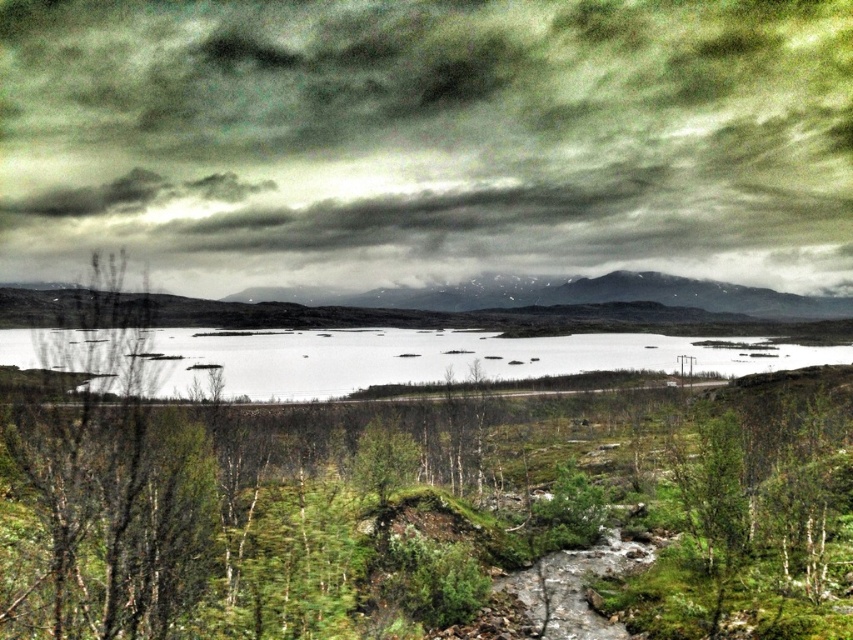
Does cloudy sky at upper center have a greater width compared to green leafy shrubs at center?

Correct, the width of cloudy sky at upper center exceeds that of green leafy shrubs at center.

Can you confirm if cloudy sky at upper center is taller than green leafy shrubs at center?

Yes.

Between point (651, 259) and point (164, 506), which one is positioned behind?

The point (651, 259) is more distant.

Locate an element on the screen. This screenshot has width=853, height=640. cloudy sky at upper center is located at coordinates click(426, 140).

Is cloudy sky at upper center to the right of white smooth water at center from the viewer's perspective?

No, cloudy sky at upper center is not to the right of white smooth water at center.

Which is behind, point (554, 48) or point (347, 346)?

The point (554, 48) is behind.

Is point (669, 244) in front of point (270, 339)?

That is False.

You are a GUI agent. You are given a task and a screenshot of the screen. Output one action in this format:
    pyautogui.click(x=<x>, y=<y>)
    Task: Click on the cloudy sky at upper center
    The width and height of the screenshot is (853, 640).
    Given the screenshot: What is the action you would take?
    pyautogui.click(x=426, y=140)

Is point (770, 424) positioned in front of point (80, 332)?

That is True.

Who is taller, green leafy shrubs at center or white smooth water at center?

white smooth water at center is taller.

Is point (230, 424) more distant than point (814, 353)?

No, (230, 424) is closer to viewer.

At what (x,y) coordinates should I click in order to perform the action: click on green leafy shrubs at center. Please return your answer as a coordinate pair (x, y). The height and width of the screenshot is (640, 853). Looking at the image, I should click on (413, 508).